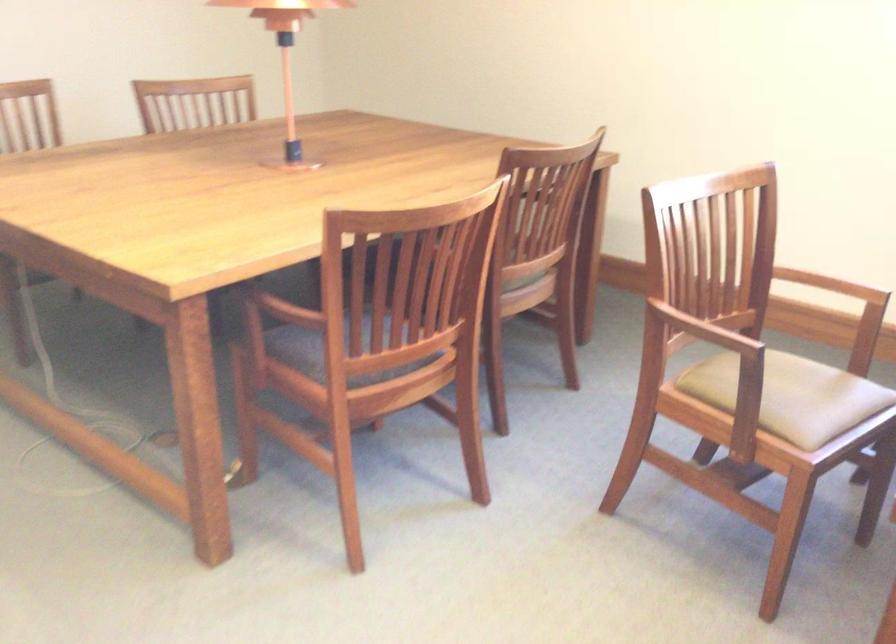
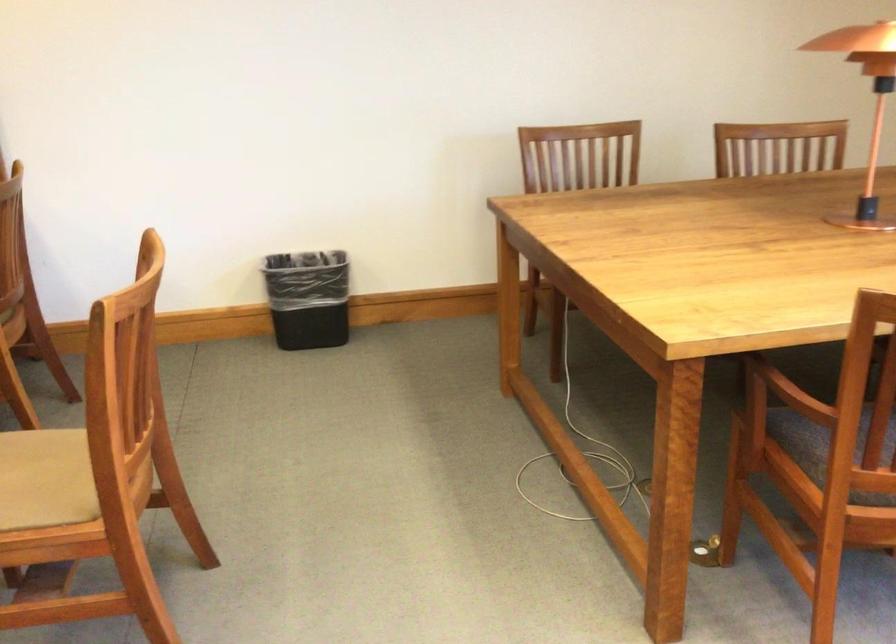
Question: The first image is from the beginning of the video and the second image is from the end. How did the camera likely rotate when shooting the video?

Choices:
 (A) Left
 (B) Right
 (C) Up
 (D) Down

Answer: (A)